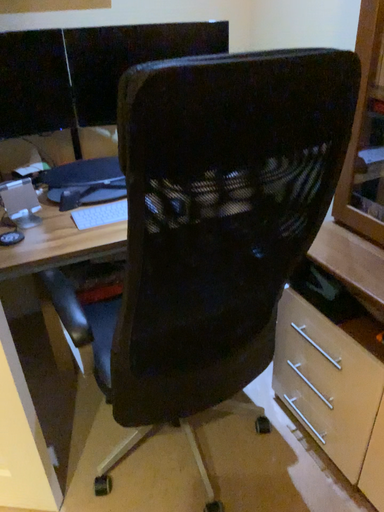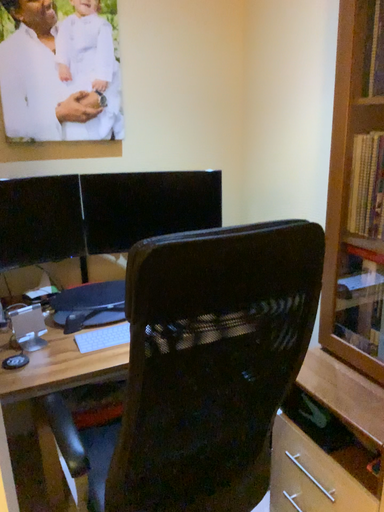
Question: How did the camera likely rotate when shooting the video?

Choices:
 (A) rotated upward
 (B) rotated downward

Answer: (A)